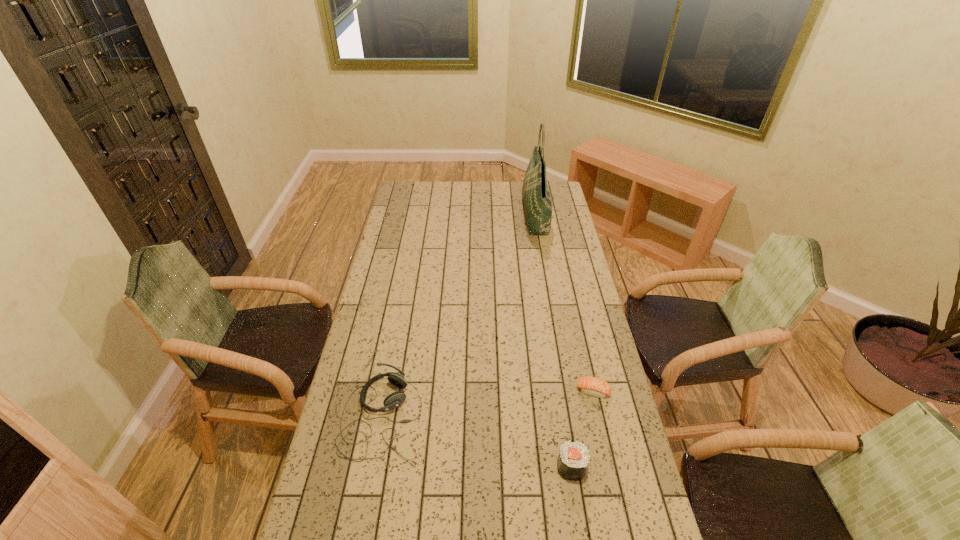
What are the coordinates of `free space between the headset and the tallest object` in the screenshot? It's located at (459, 317).

Image resolution: width=960 pixels, height=540 pixels. Identify the location of vacant space that is in between the left sushi and the shorter sushi. (583, 429).

Identify the location of free space that is in between the headset and the farther sushi. (488, 404).

Where is `vacant point located between the tallest object and the farther sushi`? vacant point located between the tallest object and the farther sushi is located at coordinates (564, 303).

Where is `vacant area between the nearer sushi and the shorter sushi`? The width and height of the screenshot is (960, 540). vacant area between the nearer sushi and the shorter sushi is located at coordinates (583, 429).

Identify the location of free space between the tallest object and the leftmost object. (459, 317).

Identify the location of free space between the taller sushi and the leftmost object. The height and width of the screenshot is (540, 960). (477, 442).

Locate an element on the screen. The width and height of the screenshot is (960, 540). free spot between the shortest object and the nearer sushi is located at coordinates (583, 429).

Locate an element on the screen. This screenshot has height=540, width=960. empty space between the tallest object and the left sushi is located at coordinates (553, 341).

At what (x,y) coordinates should I click in order to perform the action: click on object that is the third closest to the taller sushi. Please return your answer as a coordinate pair (x, y). This screenshot has width=960, height=540. Looking at the image, I should click on (536, 197).